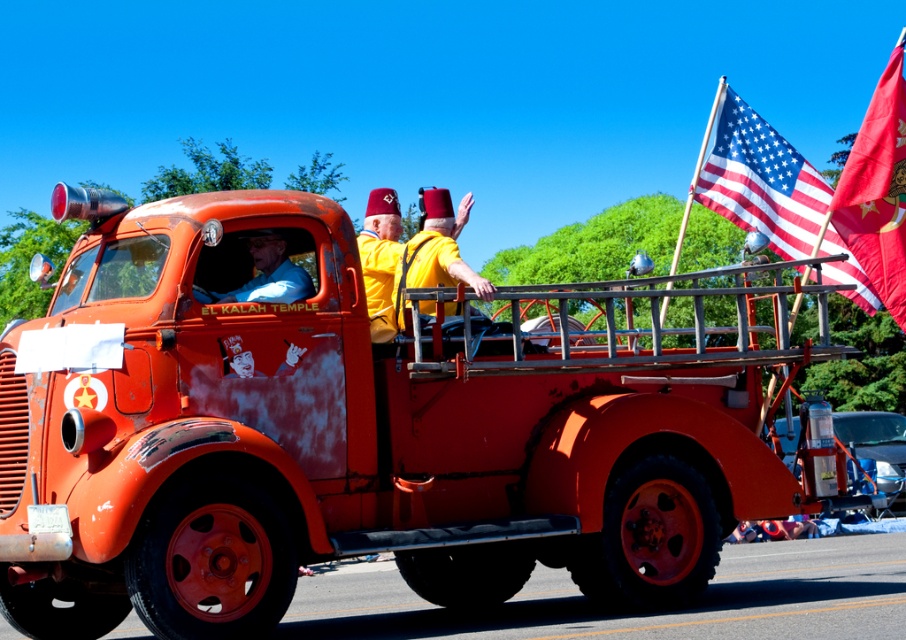
Question: Does rusty orange fire truck at center appear over red fabric flag at upper right?

Choices:
 (A) yes
 (B) no

Answer: (B)

Question: Which object appears farthest from the camera in this image?

Choices:
 (A) matte yellow shirt at center
 (B) red fabric flag at upper right
 (C) yellow matte fez at center
 (D) american flag at upper center

Answer: (D)

Question: Which of the following is the farthest from the observer?

Choices:
 (A) rusty orange fire truck at center
 (B) american flag at upper center
 (C) matte yellow shirt at center
 (D) yellow matte fez at center

Answer: (B)

Question: Does red fabric flag at upper right have a larger size compared to matte yellow shirt at center?

Choices:
 (A) no
 (B) yes

Answer: (B)

Question: Can you confirm if yellow matte fez at center is thinner than matte yellow shirt at center?

Choices:
 (A) yes
 (B) no

Answer: (A)

Question: Considering the real-world distances, which object is farthest from the matte yellow shirt at center?

Choices:
 (A) yellow matte fez at center
 (B) rusty orange fire truck at center
 (C) red fabric flag at upper right
 (D) american flag at upper center

Answer: (D)